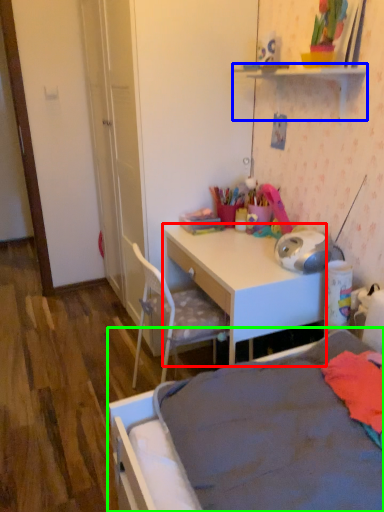
Question: Which object is the farthest from desk (highlighted by a red box)? Choose among these: shelf (highlighted by a blue box) or bed (highlighted by a green box).

Choices:
 (A) shelf
 (B) bed

Answer: (A)